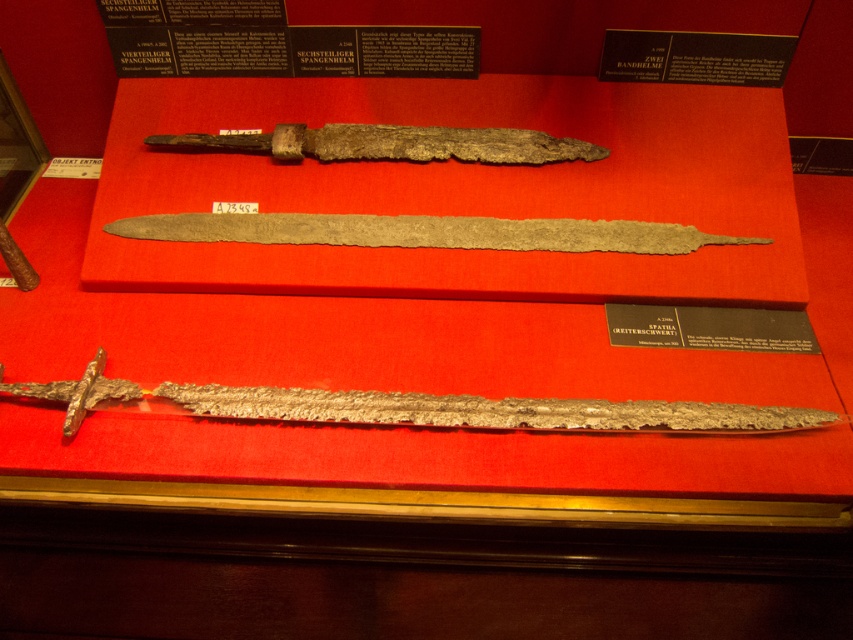
You are a museum security guard who needs to place a 15 inch long barrier between the rusty metal dagger at center and the silver metallic dagger at center. Can you fit the barrier between them?

The rusty metal dagger at center is 14.97 inches from silver metallic dagger at center. Since the barrier is 15 inches long, it cannot fit between them as the distance is slightly less than the barrier length.

You are a museum visitor standing in front of the three swords displayed on the red background. You notice two points labeled as point (416, 420) and point (410, 132). Which of these two points is closer to you?

Point (416, 420) is closer to the camera than point (410, 132), so the point labeled (416, 420) is closer to you.